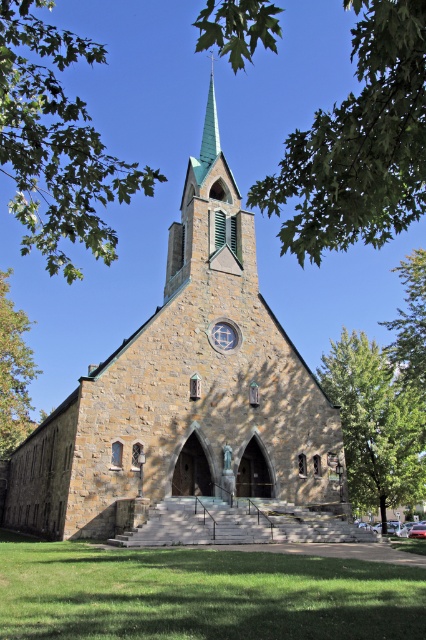
Question: Is green leafy tree at upper center thinner than green leafy tree at upper right?

Choices:
 (A) yes
 (B) no

Answer: (B)

Question: Which object is positioned farthest from the green leafy tree at right?

Choices:
 (A) green leafy tree at upper left
 (B) green leafy tree at upper right

Answer: (A)

Question: Which point is closer to the camera?

Choices:
 (A) (190, 448)
 (B) (11, 342)
 (C) (400, 140)

Answer: (C)

Question: Does green leafy tree at upper center have a smaller size compared to green leafy tree at upper right?

Choices:
 (A) no
 (B) yes

Answer: (A)

Question: Estimate the real-world distances between objects in this image. Which object is farther from the green leafy tree at upper left?

Choices:
 (A) green glass spire at upper center
 (B) green leafy tree at upper center

Answer: (A)

Question: Can you confirm if brown stone church at center is smaller than green leafy tree at upper center?

Choices:
 (A) yes
 (B) no

Answer: (A)